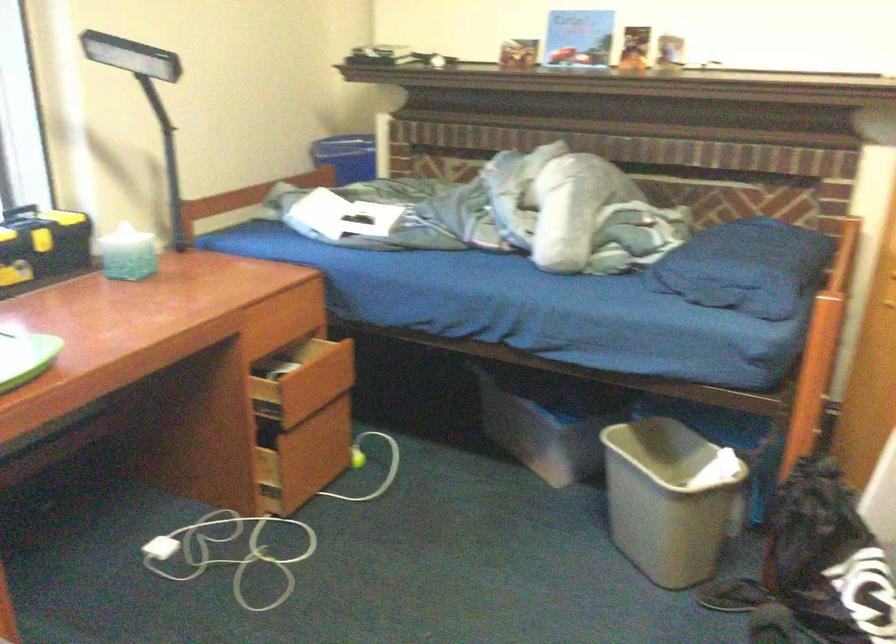
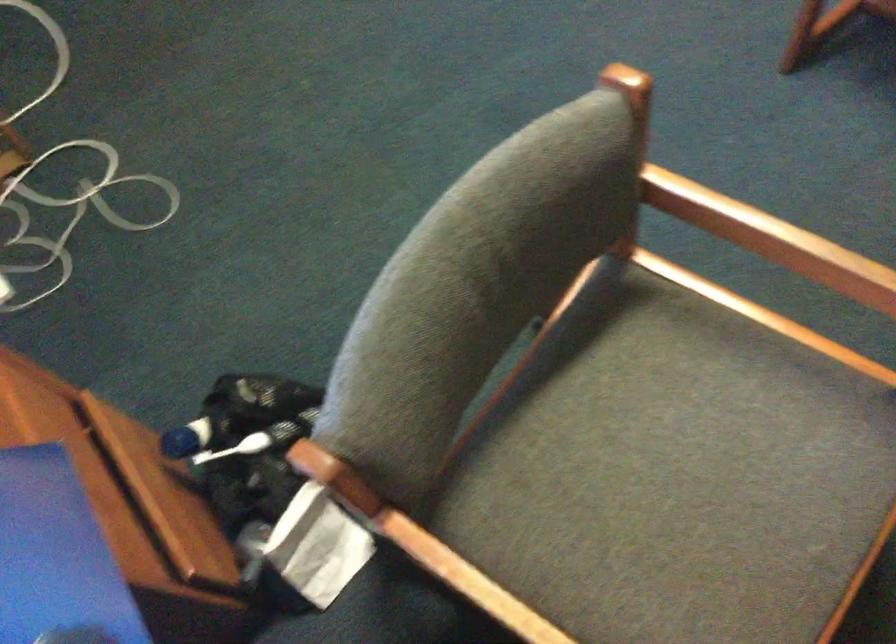
Where in the second image is the point corresponding to (x=270, y=544) from the first image?

(63, 184)